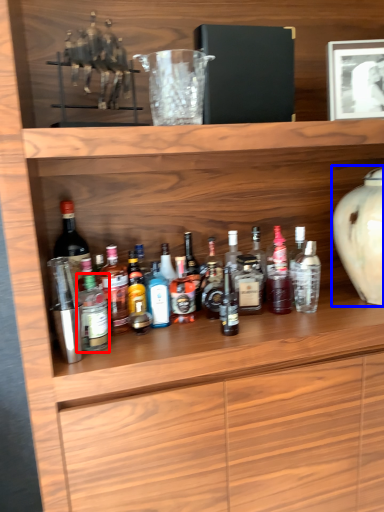
Question: Which object is closer to the camera taking this photo, bottle (highlighted by a red box) or vase (highlighted by a blue box)?

Choices:
 (A) bottle
 (B) vase

Answer: (A)